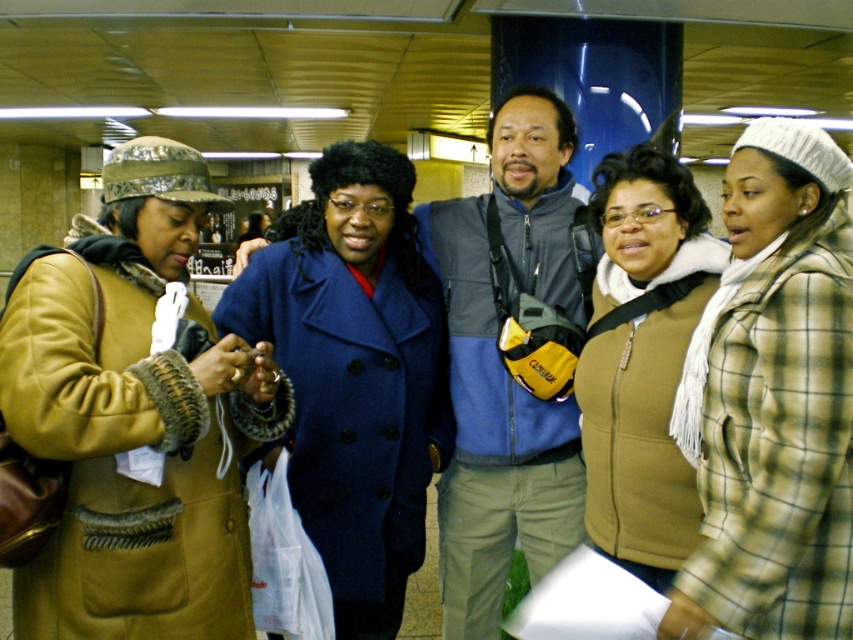
Who is positioned more to the right, plaid woolen jacket at center or matte blue coat at center?

From the viewer's perspective, plaid woolen jacket at center appears more on the right side.

Is point (822, 582) in front of point (370, 273)?

Yes, point (822, 582) is in front of point (370, 273).

Describe the element at coordinates (773, 400) in the screenshot. The image size is (853, 640). I see `plaid woolen jacket at center` at that location.

The image size is (853, 640). Find the location of `plaid woolen jacket at center`. plaid woolen jacket at center is located at coordinates (773, 400).

Who is more distant from viewer, (x=339, y=164) or (x=618, y=506)?

Point (x=339, y=164)

Can you confirm if matte blue coat at center is positioned above matte brown vest at center?

Actually, matte blue coat at center is below matte brown vest at center.

Does point (393, 624) come closer to viewer compared to point (648, 342)?

That is False.

Identify the location of matte blue coat at center. This screenshot has height=640, width=853. (354, 372).

Does leather jacket at left have a larger size compared to matte brown vest at center?

Correct, leather jacket at left is larger in size than matte brown vest at center.

Between point (90, 252) and point (666, 256), which one is positioned behind?

The point (666, 256) is behind.

Is point (163, 570) positioned before point (666, 292)?

Yes, point (163, 570) is closer to viewer.

Locate an element on the screen. Image resolution: width=853 pixels, height=640 pixels. leather jacket at left is located at coordinates tap(135, 419).